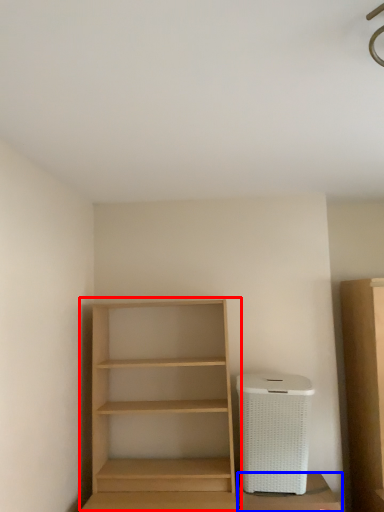
Question: Which object is closer to the camera taking this photo, shelf (highlighted by a red box) or cabinetry (highlighted by a blue box)?

Choices:
 (A) shelf
 (B) cabinetry

Answer: (A)